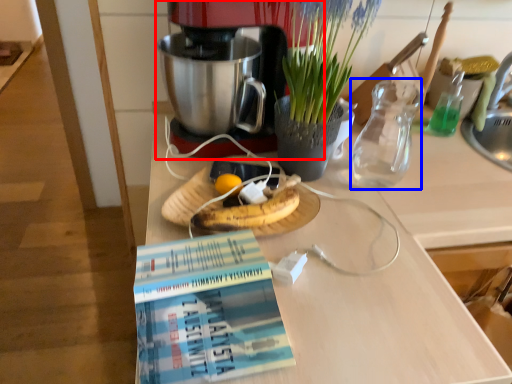
Question: Which point is closer to the camera, coffee maker (highlighted by a red box) or tea pot (highlighted by a blue box)?

Choices:
 (A) coffee maker
 (B) tea pot

Answer: (A)